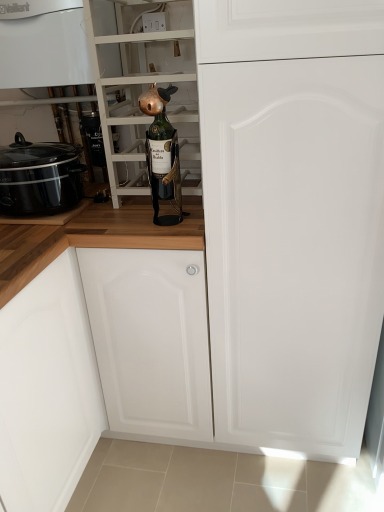
Identify the location of vacant space in between black glossy slow cooker at left and green glass bottle at center. This screenshot has width=384, height=512. (122, 219).